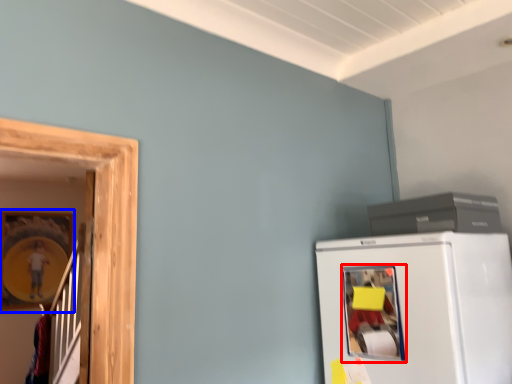
Question: Which point is further to the camera, window (highlighted by a red box) or picture frame (highlighted by a blue box)?

Choices:
 (A) window
 (B) picture frame

Answer: (B)